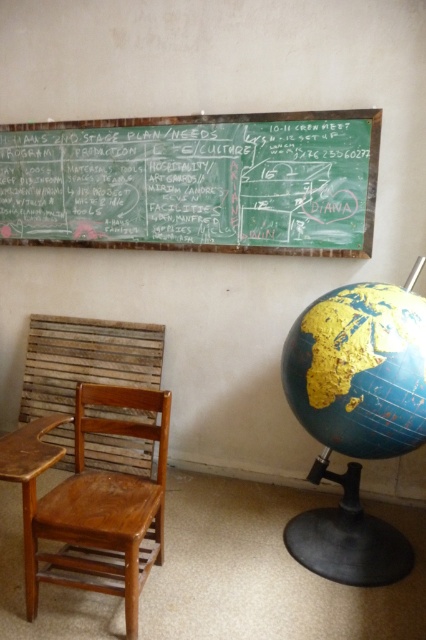
Can you confirm if wooden chair at left is smaller than brown wood table at left?

No, wooden chair at left is not smaller than brown wood table at left.

Can you confirm if wooden chair at left is positioned below brown wood table at left?

Yes.

Is point (60, 540) closer to camera compared to point (3, 480)?

No, it is behind (3, 480).

Identify the location of wooden chair at left. This screenshot has width=426, height=640. (106, 506).

Which is below, blue matte globe at lower right or wooden chair at left?

wooden chair at left

Who is more forward, (322, 385) or (100, 493)?

Point (322, 385)

Locate an element on the screen. This screenshot has height=640, width=426. blue matte globe at lower right is located at coordinates (359, 369).

Is green chalkboard at upper center below blue matte globe at lower right?

No, green chalkboard at upper center is not below blue matte globe at lower right.

Looking at this image, which of these two, green chalkboard at upper center or blue matte globe at lower right, stands shorter?

With less height is blue matte globe at lower right.

Locate an element on the screen. This screenshot has height=640, width=426. green chalkboard at upper center is located at coordinates (195, 182).

Where is `green chalkboard at upper center`? The width and height of the screenshot is (426, 640). green chalkboard at upper center is located at coordinates (195, 182).